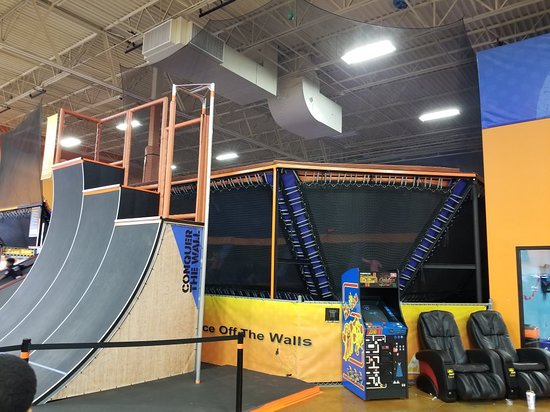
The image size is (550, 412). Find the location of `floor`. floor is located at coordinates (329, 405).